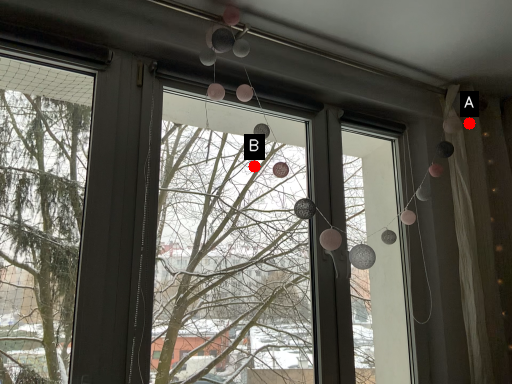
Question: Two points are circled on the image, labeled by A and B beside each circle. Which point is farther from the camera taking this photo?

Choices:
 (A) A is further
 (B) B is further

Answer: (B)